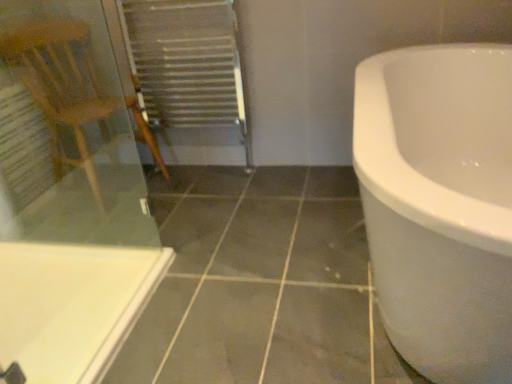
What do you see at coordinates (73, 130) in the screenshot? I see `transparent glass screen door at left` at bounding box center [73, 130].

Locate an element on the screen. This screenshot has height=384, width=512. transparent glass screen door at left is located at coordinates (73, 130).

Locate an element on the screen. The image size is (512, 384). transparent glass screen door at left is located at coordinates (73, 130).